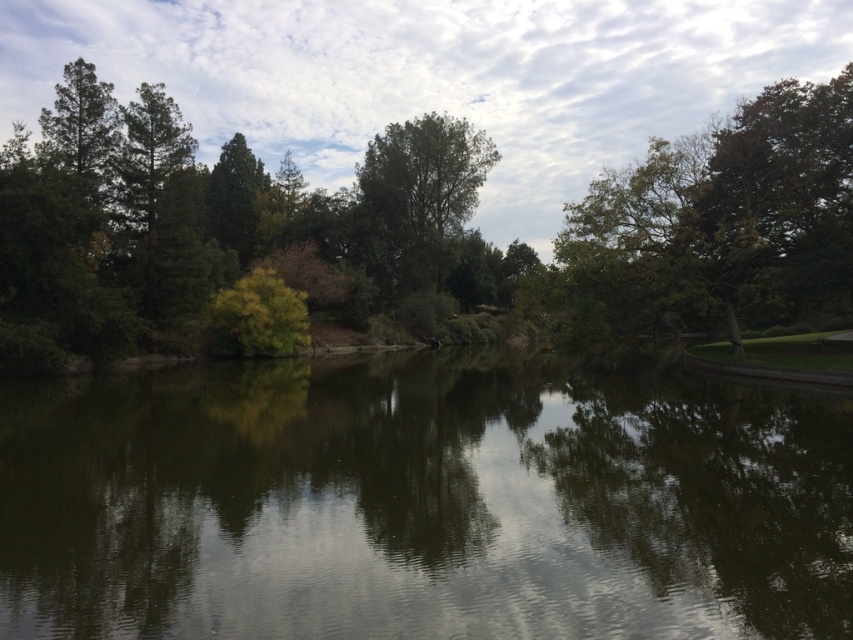
Question: Does green reflective water at center lie in front of green leafy tree at right?

Choices:
 (A) no
 (B) yes

Answer: (B)

Question: Which is farther from the green reflective water at center?

Choices:
 (A) green leafy tree at center
 (B) green matte tree at center
 (C) green leafy tree at right

Answer: (A)

Question: Can you confirm if green reflective water at center is positioned above green leafy tree at right?

Choices:
 (A) yes
 (B) no

Answer: (B)

Question: Among these objects, which one is farthest from the camera?

Choices:
 (A) green leafy tree at right
 (B) green leafy tree at center

Answer: (B)

Question: Can you confirm if green reflective water at center is bigger than green matte tree at center?

Choices:
 (A) no
 (B) yes

Answer: (A)

Question: Which of these objects is positioned closest to the green leafy tree at right?

Choices:
 (A) green leafy tree at center
 (B) green reflective water at center
 (C) green matte tree at center

Answer: (B)